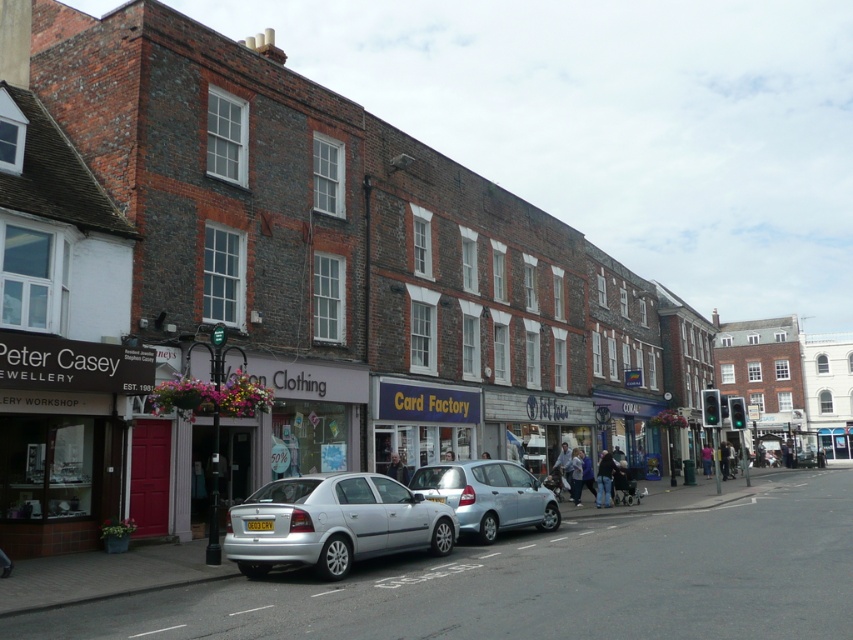
You are standing on the street in front of the shops. There are two points marked in the scene. The first point is at coordinates point (285, 541) and the second is at point (579, 490). If you want to walk towards the point that is closer to you, which point should you head towards?

You should head towards point (285, 541) because it is closer to the viewer than point (579, 490).

You are a pedestrian standing on the sidewalk and see a silver metallic hatchback at center and light blue jeans at center. Which object is nearer to you?

The silver metallic hatchback at center is closer to the viewer than the light blue jeans at center.

You are a delivery person who needs to load a large package into your vehicle. You see a silver metallic hatchback at center and a light brown leather jacket at center. Which object is taller and can accommodate the package?

The silver metallic hatchback at center is much taller than the light brown leather jacket at center, so the package can be placed inside the silver metallic hatchback at center.